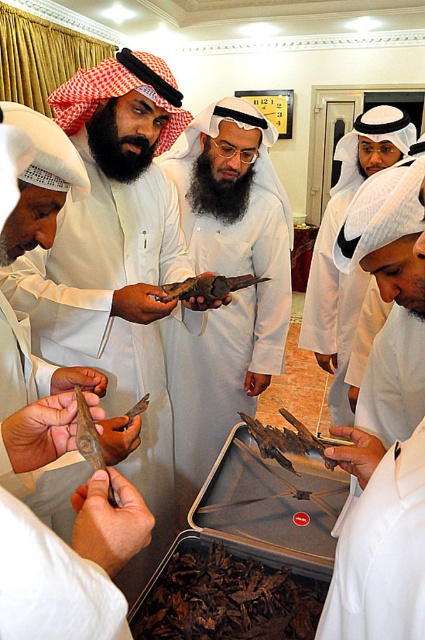
You are a guest at this formal gathering and need to reach for the white matte phone at center to make an urgent call. However, the white matte robe at center is blocking your access. Can you easily move the robe to access the phone?

The white matte robe at center is behind the white matte phone at center, so the robe is not blocking the phone. You can easily access the white matte phone at center without moving the robe.

You are a researcher examining the artifacts on the table. You need to take a photo of both the white matte phone at center and the brown dried leaves at center. Which object should you focus on first to ensure both fit in the frame?

The white matte phone at center is larger in size than the brown dried leaves at center. To ensure both fit in the frame, focus on the white matte phone at center first as it requires more space.

From the picture: You are a researcher in the room and want to take a photo of the white matte phone at center. Where should you position yourself to capture it in the frame?

The white matte phone at center is located at coordinates point (x=385, y=424), so you should position yourself directly in front of it to capture it in the frame.